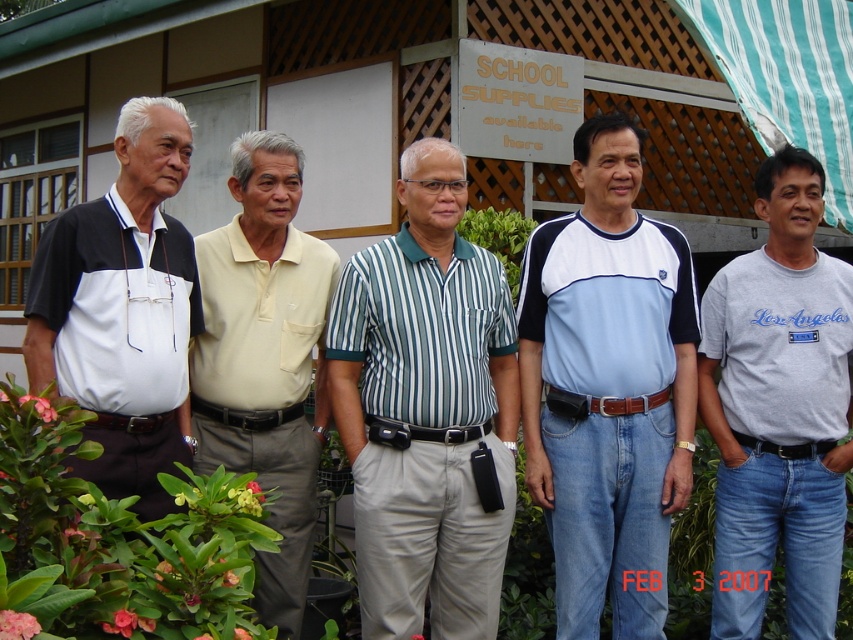
Is gray cotton t-shirt at right wider than light yellow polo shirt at center?

Yes, gray cotton t-shirt at right is wider than light yellow polo shirt at center.

This screenshot has height=640, width=853. What do you see at coordinates (778, 408) in the screenshot?
I see `gray cotton t-shirt at right` at bounding box center [778, 408].

Measure the distance between gray cotton t-shirt at right and camera.

gray cotton t-shirt at right is 24.48 feet away from camera.

You are a GUI agent. You are given a task and a screenshot of the screen. Output one action in this format:
    pyautogui.click(x=<x>, y=<y>)
    Task: Click on the gray cotton t-shirt at right
    This screenshot has height=640, width=853.
    Given the screenshot: What is the action you would take?
    pyautogui.click(x=778, y=408)

In the scene shown: Can you confirm if light blue jersey at center is bigger than green striped shirt at center?

No.

Is point (662, 376) more distant than point (408, 157)?

No.

This screenshot has width=853, height=640. What are the coordinates of `light blue jersey at center` in the screenshot? It's located at (607, 387).

Does light blue jersey at center lie behind matte black polo shirt at left?

Yes, light blue jersey at center is further from the viewer.

From the picture: Does light blue jersey at center have a greater width compared to matte black polo shirt at left?

Yes, light blue jersey at center is wider than matte black polo shirt at left.

Find the location of `light blue jersey at center`. light blue jersey at center is located at coordinates (607, 387).